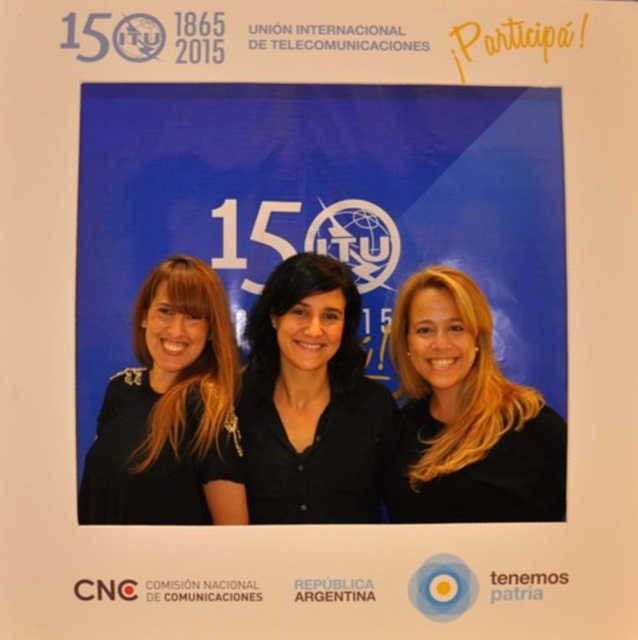
Does point (413, 392) lie behind point (230, 352)?

Yes, point (413, 392) is farther from viewer.

Does blonde hair at center lie in front of blonde hair at left?

No, it is not.

Where is `blonde hair at center`? The image size is (638, 640). blonde hair at center is located at coordinates (466, 416).

The image size is (638, 640). Identify the location of blonde hair at center. (466, 416).

Between point (302, 342) and point (152, 410), which one is positioned in front?

Point (302, 342) is in front.

Which is in front, point (353, 472) or point (115, 404)?

Point (115, 404)

The height and width of the screenshot is (640, 638). I want to click on black matte shirt at center, so click(x=309, y=401).

Between black matte shirt at center and blonde hair at center, which one appears on the left side from the viewer's perspective?

black matte shirt at center is more to the left.

Which is more to the right, black matte shirt at center or blonde hair at center?

From the viewer's perspective, blonde hair at center appears more on the right side.

At what (x,y) coordinates should I click in order to perform the action: click on black matte shirt at center. Please return your answer as a coordinate pair (x, y). This screenshot has height=640, width=638. Looking at the image, I should click on (309, 401).

Image resolution: width=638 pixels, height=640 pixels. I want to click on black matte shirt at center, so click(309, 401).